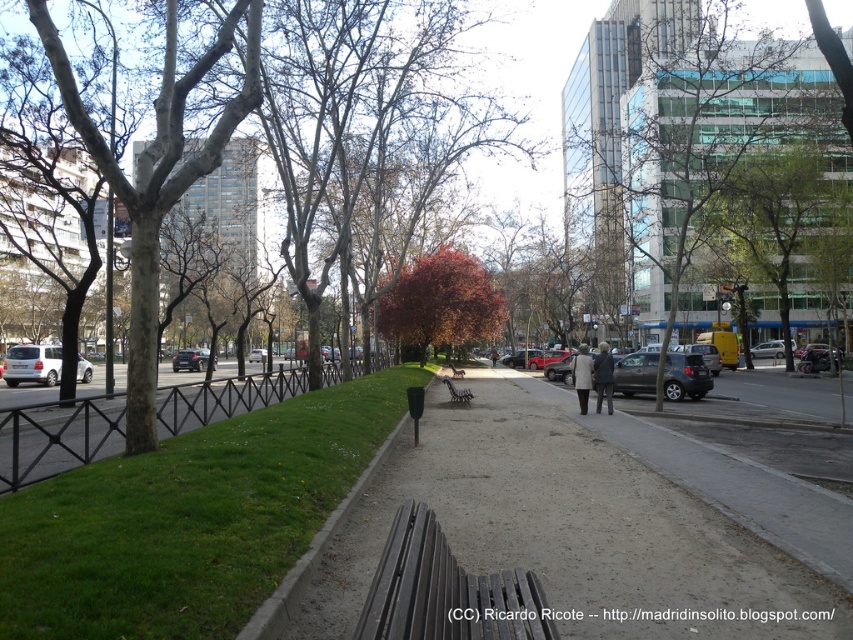
You are standing at the wooden bench at the bottom center of the frame in the park. You see two points marked in the scene. Which point, point (91, 493) or point (758, 344), is closer to you?

Point (91, 493) is closer to you than point (758, 344).